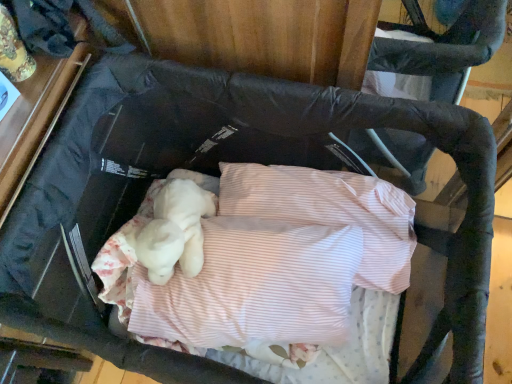
The width and height of the screenshot is (512, 384). What do you see at coordinates (277, 272) in the screenshot? I see `pink striped fabric at center` at bounding box center [277, 272].

This screenshot has height=384, width=512. I want to click on pink striped fabric at center, so click(277, 272).

This screenshot has width=512, height=384. Find the location of `pink striped fabric at center`. pink striped fabric at center is located at coordinates (277, 272).